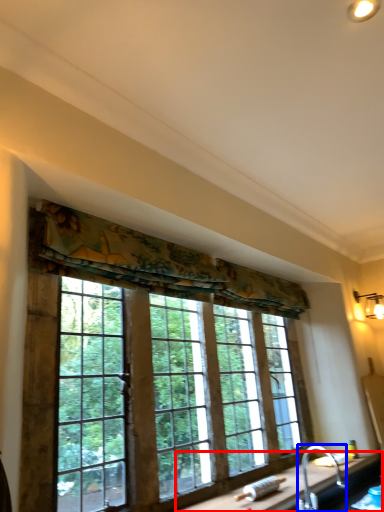
Question: Which object appears closest to the camera in this image, counter top (highlighted by a red box) or faucet (highlighted by a blue box)?

Choices:
 (A) counter top
 (B) faucet

Answer: (A)